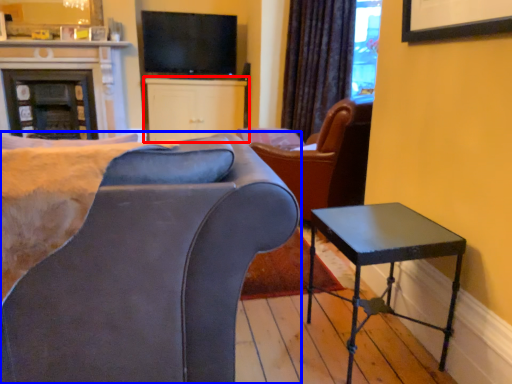
Question: Which of the following is the farthest to the observer, cabinetry (highlighted by a red box) or chair (highlighted by a blue box)?

Choices:
 (A) cabinetry
 (B) chair

Answer: (A)